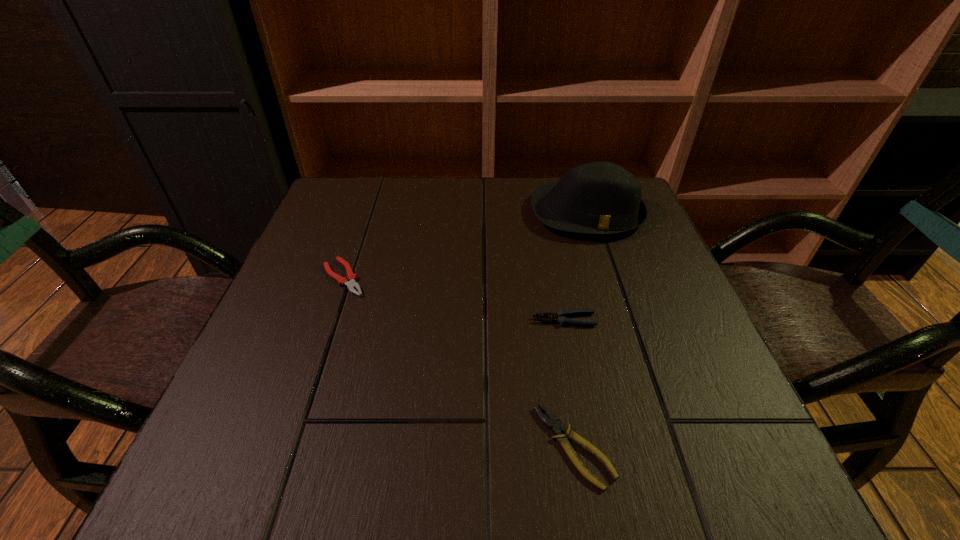
Find the location of `fedora`. fedora is located at coordinates (600, 198).

I want to click on the farthest object, so click(600, 198).

The width and height of the screenshot is (960, 540). Identify the location of the third shortest object. (560, 316).

Where is `the second nearest object`? Image resolution: width=960 pixels, height=540 pixels. the second nearest object is located at coordinates (560, 316).

Locate an element on the screen. This screenshot has width=960, height=540. the leftmost pliers is located at coordinates (352, 277).

The image size is (960, 540). Identify the location of the farthest pliers. (352, 277).

You are a GUI agent. You are given a task and a screenshot of the screen. Output one action in this format:
    pyautogui.click(x=<x>, y=<y>)
    Task: Click on the nearest object
    
    Given the screenshot: What is the action you would take?
    pyautogui.click(x=554, y=424)

Where is `vacant region located on the front-facing side of the farthest object`? This screenshot has height=540, width=960. vacant region located on the front-facing side of the farthest object is located at coordinates (625, 333).

Image resolution: width=960 pixels, height=540 pixels. In order to click on vacant region located 0.080m at the gripping part of the second nearest pliers in this screenshot , I will do `click(491, 320)`.

In order to click on vacant space situated 0.400m at the gripping part of the second nearest pliers in this screenshot , I will do `click(322, 320)`.